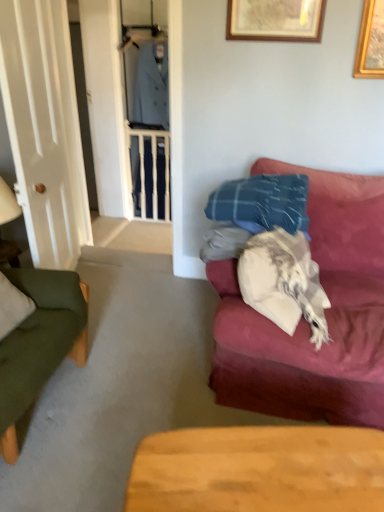
Question: In terms of height, does wooden table at lower center look taller or shorter compared to velvet red couch at right?

Choices:
 (A) short
 (B) tall

Answer: (A)

Question: Considering the positions of wooden table at lower center and velvet red couch at right in the image, is wooden table at lower center wider or thinner than velvet red couch at right?

Choices:
 (A) wide
 (B) thin

Answer: (B)

Question: Which object is the closest to the velvet red couch at right?

Choices:
 (A) wooden framed picture at upper center
 (B) white glossy door at left
 (C) wooden table at lower center
 (D) wooden balustrade at center

Answer: (C)

Question: Estimate the real-world distances between objects in this image. Which object is closer to the wooden table at lower center?

Choices:
 (A) wooden balustrade at center
 (B) velvet red couch at right
 (C) wooden framed picture at upper center
 (D) white glossy door at left

Answer: (B)